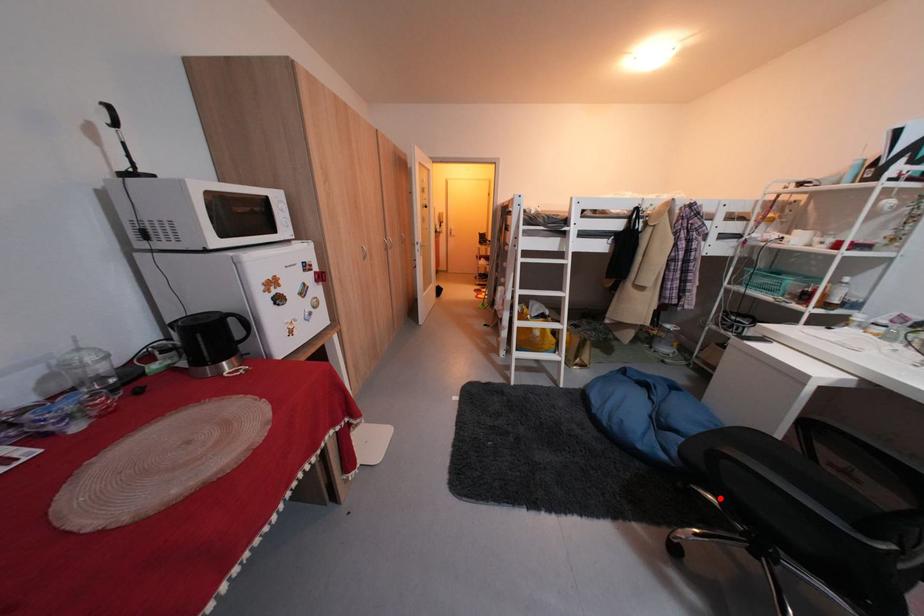
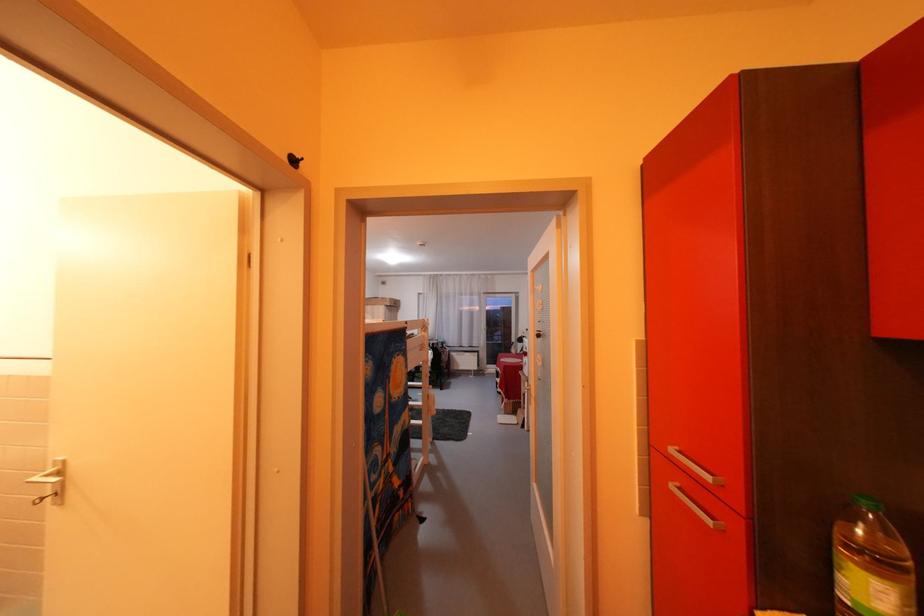
Question: I am providing you with two images of the same scene from different viewpoints. A red point is marked on the first image. At the location where the point appears in image 1, is it still visible in image 2?

Choices:
 (A) Yes
 (B) No

Answer: (B)